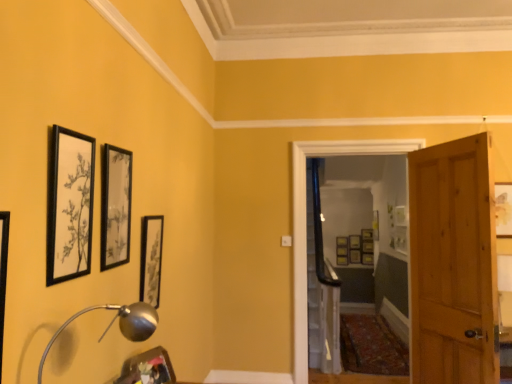
Question: From the image's perspective, is matte black picture frame at center, which ranks as the fourth picture frame in right-to-left order, positioned above or below wooden picture frame at center, the 7th picture frame viewed from the back?

Choices:
 (A) below
 (B) above

Answer: (B)

Question: Based on their positions, is matte black picture frame at center, the 11th picture frame when ordered from left to right, located to the left or right of wooden picture frame at center, acting as the thirteenth picture frame starting from the left?

Choices:
 (A) right
 (B) left

Answer: (B)

Question: Estimate the real-world distances between objects in this image. Which object is closer to the wooden door at center, the 2th door in the front-to-back sequence?

Choices:
 (A) wooden picture frame at center, placed as the eighth picture frame when sorted from right to left
 (B) black matte picture frame at center-left, the 11th picture frame from the right
 (C) matte black picture frame at upper center, the twelfth picture frame in the back-to-front sequence
 (D) wooden picture frame at center, the 10th picture frame in the front-to-back sequence
 (E) wooden picture frame at center, which is counted as the twelfth picture frame, starting from the front

Answer: (B)

Question: Which object is positioned farthest from the silver metallic table lamp at lower left?

Choices:
 (A) matte black picture frame at center, which is the 3th picture frame in right-to-left order
 (B) matte black picture frame at center, which ranks as the fourth picture frame in right-to-left order
 (C) wooden picture frame at center, the 10th picture frame in the front-to-back sequence
 (D) wooden door at center, the 2th door in the front-to-back sequence
 (E) black matte picture frame at upper left, marked as the 2th picture frame in a front-to-back arrangement

Answer: (B)